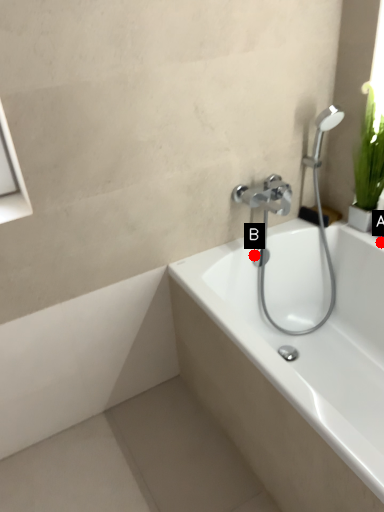
Question: Two points are circled on the image, labeled by A and B beside each circle. Which of the following is the farthest from the observer?

Choices:
 (A) A is further
 (B) B is further

Answer: (B)